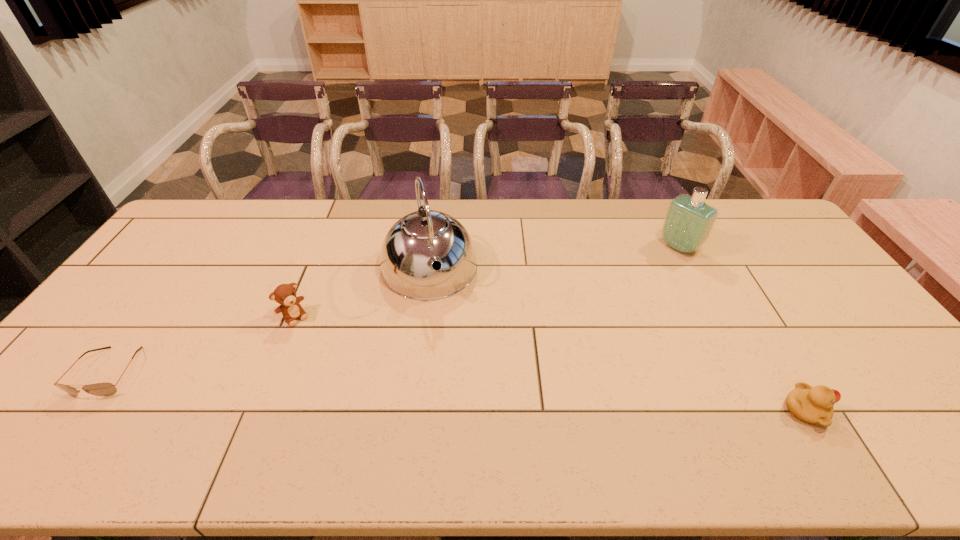
Where is `free space located 0.300m from the spout of the tallest object`? This screenshot has width=960, height=540. free space located 0.300m from the spout of the tallest object is located at coordinates (463, 392).

This screenshot has width=960, height=540. Find the location of `free spot located 0.290m from the spout of the tallest object`. free spot located 0.290m from the spout of the tallest object is located at coordinates (462, 388).

Identify the location of free space located on the front label of the second tallest object. pyautogui.click(x=590, y=313).

Locate an element on the screen. Image resolution: width=960 pixels, height=540 pixels. vacant area located on the front label of the second tallest object is located at coordinates (660, 262).

Image resolution: width=960 pixels, height=540 pixels. What are the coordinates of `free space located on the front label of the second tallest object` in the screenshot? It's located at (651, 268).

Find the location of a particular element. free space located on the face of the teddy bear is located at coordinates (373, 407).

Where is `blank space located 0.080m on the face of the teddy bear`? blank space located 0.080m on the face of the teddy bear is located at coordinates (316, 340).

Image resolution: width=960 pixels, height=540 pixels. In order to click on vacant space situated 0.090m on the face of the teddy bear in this screenshot , I will do `click(318, 342)`.

Identify the location of kettle at the far edge. (415, 242).

This screenshot has width=960, height=540. I want to click on perfume positioned at the far edge, so [689, 221].